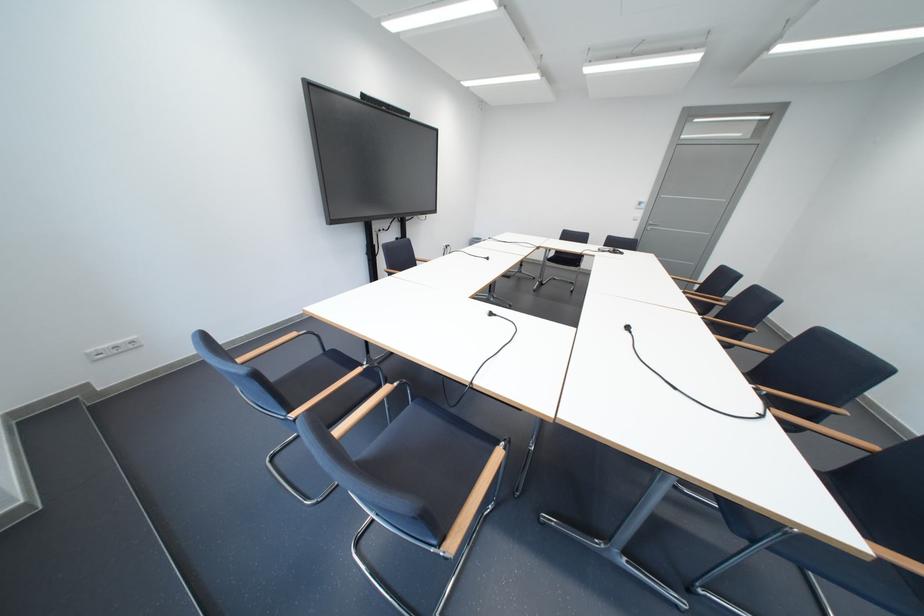
The height and width of the screenshot is (616, 924). I want to click on grey door handle, so click(650, 225).